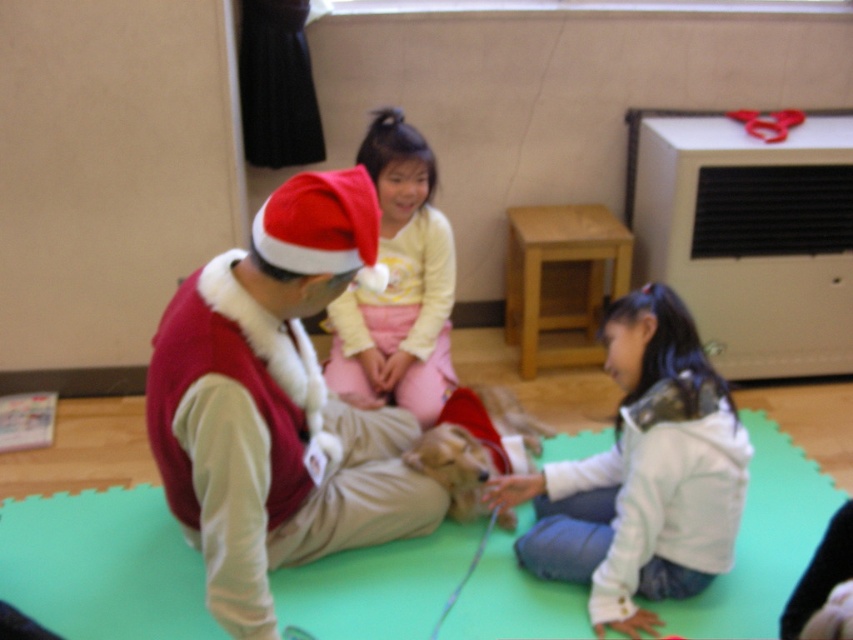
You are a delivery robot 1.2 meters tall. You need to deliver a package to the fuzzy red vest at center. Can you reach it without climbing anything?

The distance between the fuzzy red vest at center and the viewer is 1.39 meters. Since the robot is 1.2 meters tall, it cannot reach the vest unless it climbs something to bridge the distance.

In the scene shown: You are a photographer taking a picture of the scene. You want to focus on the fuzzy red vest at center and the white fleece jacket at lower right. Which object should you adjust your camera focus to first to ensure both are in focus?

The fuzzy red vest at center is closer to the viewer than the white fleece jacket at lower right. To ensure both are in focus, focus on the fuzzy red vest at center first, as it is closer, and the white fleece jacket at lower right will fall into the depth of field behind it.

In the scene where the adult in the fuzzy red vest at center and the child in the light yellow fleece shirt at center are sitting on a green mat, which piece of clothing is positioned to the right?

The light yellow fleece shirt at center is to the right of the fuzzy red vest at center.